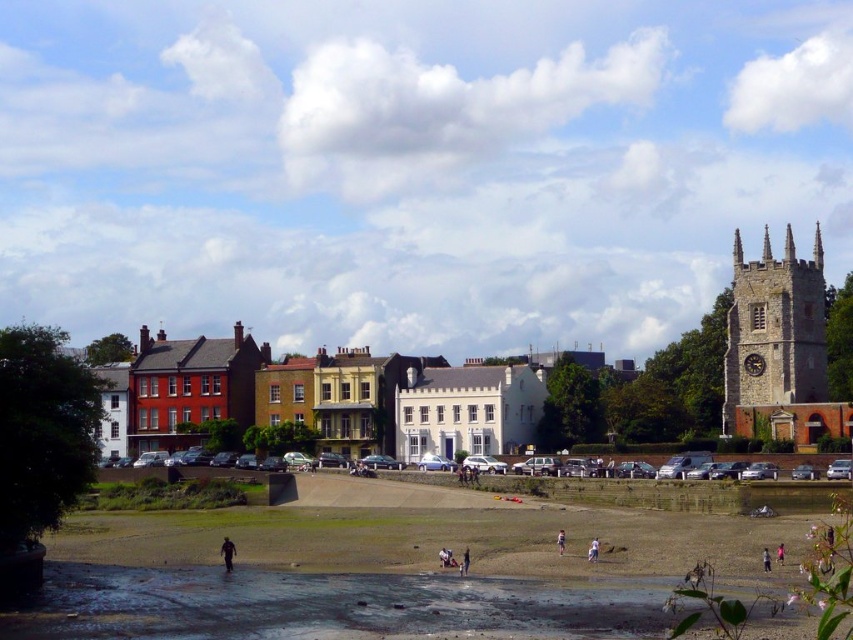
Who is more distant from viewer, (433, 621) or (786, 312)?

Positioned behind is point (786, 312).

Identify the location of green grass park at lower center. (393, 566).

Is point (753, 541) closer to camera compared to point (560, 534)?

Yes, point (753, 541) is closer to viewer.

Who is positioned more to the right, green grass park at lower center or light brown hair at lower center?

From the viewer's perspective, light brown hair at lower center appears more on the right side.

Locate an element on the screen. Image resolution: width=853 pixels, height=640 pixels. green grass park at lower center is located at coordinates (393, 566).

Does white cotton shirt at lower center lie in front of pink fabric person at lower right?

No, white cotton shirt at lower center is further to the viewer.

Between white cotton shirt at lower center and pink fabric person at lower right, which one is positioned higher?

Positioned higher is white cotton shirt at lower center.

Find the location of a particular element. The height and width of the screenshot is (640, 853). white cotton shirt at lower center is located at coordinates (593, 550).